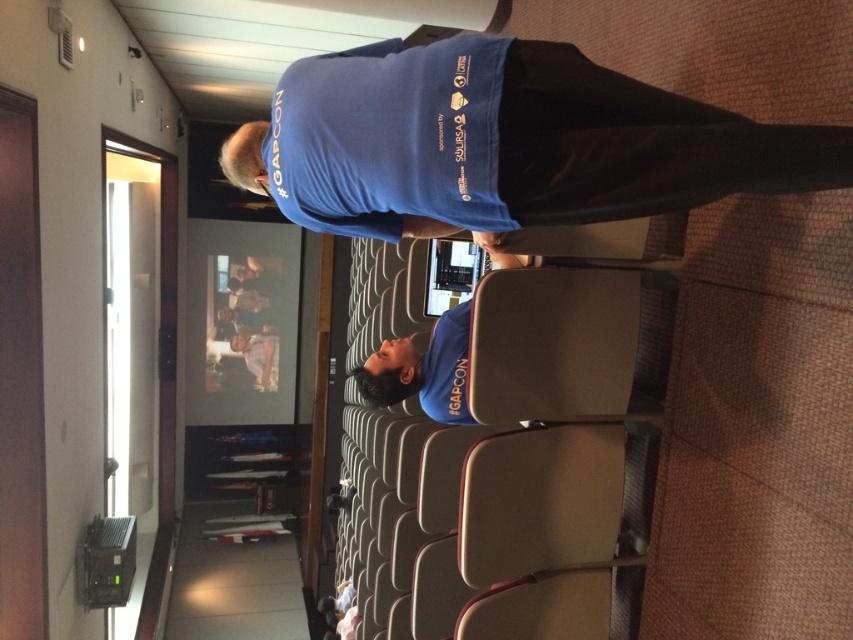
Looking at this image, which is more to the right, blue fabric shirt at center or blue fabric at center?

Positioned to the right is blue fabric shirt at center.

You are a GUI agent. You are given a task and a screenshot of the screen. Output one action in this format:
    pyautogui.click(x=<x>, y=<y>)
    Task: Click on the blue fabric shirt at center
    The width and height of the screenshot is (853, 640).
    Given the screenshot: What is the action you would take?
    pyautogui.click(x=505, y=141)

Looking at this image, who is taller, blue matte shirt at lower center or blue fabric at center?

Standing taller between the two is blue matte shirt at lower center.

Does blue matte shirt at lower center appear on the right side of blue fabric at center?

Yes, blue matte shirt at lower center is to the right of blue fabric at center.

You are a GUI agent. You are given a task and a screenshot of the screen. Output one action in this format:
    pyautogui.click(x=<x>, y=<y>)
    Task: Click on the blue matte shirt at lower center
    The width and height of the screenshot is (853, 640).
    Given the screenshot: What is the action you would take?
    pyautogui.click(x=416, y=365)

Does point (524, 120) lie behind point (415, 380)?

That is False.

Is point (421, 68) less distant than point (387, 388)?

Yes, it is in front of point (387, 388).

This screenshot has height=640, width=853. Describe the element at coordinates (505, 141) in the screenshot. I see `blue fabric shirt at center` at that location.

Where is `blue fabric shirt at center`? This screenshot has width=853, height=640. blue fabric shirt at center is located at coordinates [505, 141].